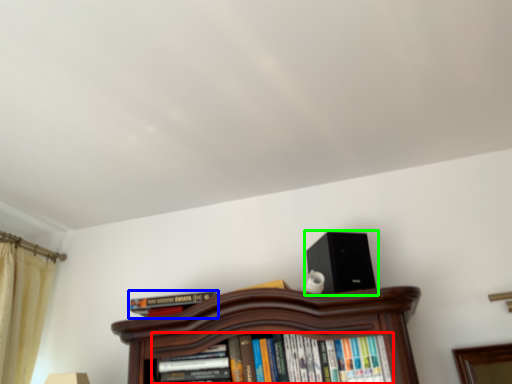
Question: Considering the real-world distances, which object is closest to book (highlighted by a red box)? book (highlighted by a blue box) or loudspeaker (highlighted by a green box).

Choices:
 (A) book
 (B) loudspeaker

Answer: (B)